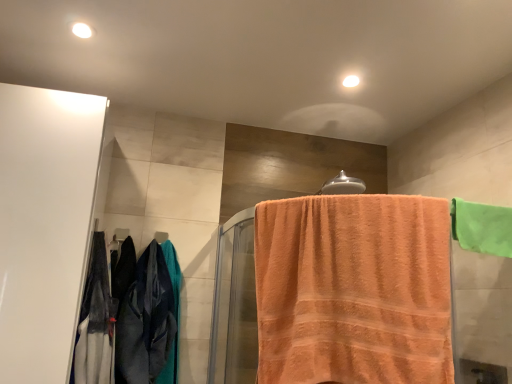
Question: From a real-world perspective, relative to white glossy cabinet at left, is green fabric towel at upper right, the 2th towel viewed from the left, vertically above or below?

Choices:
 (A) below
 (B) above

Answer: (B)

Question: Is green fabric towel at upper right, which is counted as the first towel, starting from the right, taller or shorter than white glossy cabinet at left?

Choices:
 (A) tall
 (B) short

Answer: (B)

Question: Estimate the real-world distances between objects in this image. Which object is closer to the white glossy cabinet at left?

Choices:
 (A) metallic gray towel bar at upper left, which is the 2th towel bar from front to back
 (B) velvet-like dark blue pants at left
 (C) silver metallic towel bar at upper center, marked as the 2th towel bar in a bottom-to-top arrangement
 (D) green fabric towel at upper right, which is counted as the first towel, starting from the right
 (E) orange terry cloth towel at center, which is counted as the 2th towel, starting from the right

Answer: (B)

Question: Considering the real-world distances, which object is closest to the metallic gray towel bar at upper left, which is the first towel bar from back to front?

Choices:
 (A) green fabric towel at upper right, which is counted as the first towel, starting from the right
 (B) silver metallic towel bar at upper center, marked as the 2th towel bar in a bottom-to-top arrangement
 (C) velvet-like dark blue pants at left
 (D) white glossy cabinet at left
 (E) orange terry cloth towel at center, which is counted as the 2th towel, starting from the right

Answer: (C)